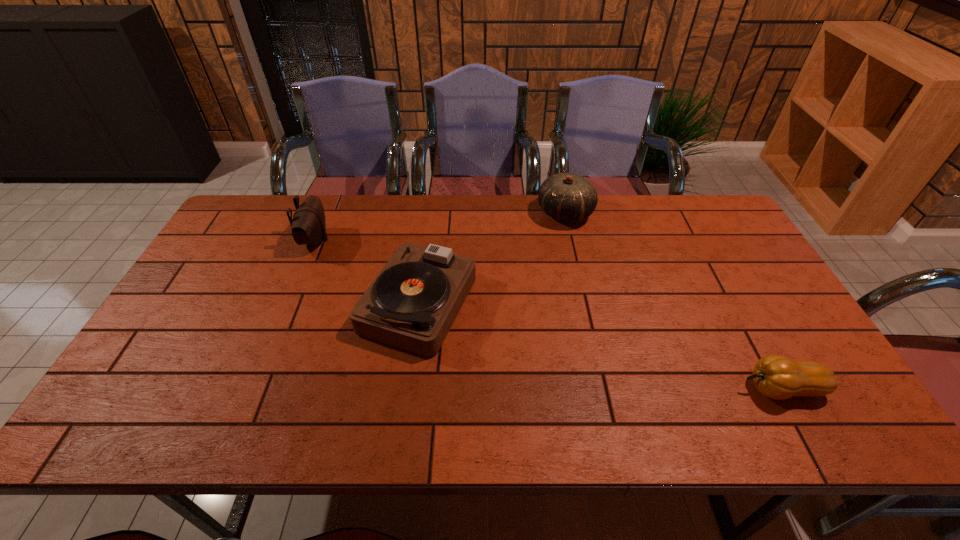
Find the location of `free space at the right edge of the desktop`. free space at the right edge of the desktop is located at coordinates (699, 256).

Locate an element on the screen. vacant region at the far left corner of the desktop is located at coordinates (252, 238).

I want to click on vacant space at the far right corner of the desktop, so click(x=679, y=201).

I want to click on free space between the pouch and the shorter gourd, so click(x=548, y=315).

Find the location of a particular element. The height and width of the screenshot is (540, 960). vacant area that lies between the leftmost object and the shorter gourd is located at coordinates 548,315.

Identify the location of unoccupied area between the second object from left to right and the shorter gourd. (600, 346).

You are a GUI agent. You are given a task and a screenshot of the screen. Output one action in this format:
    pyautogui.click(x=<x>, y=<y>)
    Task: Click on the blank region between the pouch and the third object from right to left
    The height and width of the screenshot is (540, 960).
    Given the screenshot: What is the action you would take?
    pyautogui.click(x=367, y=271)

At what (x,y) coordinates should I click in order to perform the action: click on empty space that is in between the nearer gourd and the record player. Please return your answer as a coordinate pair (x, y). This screenshot has height=540, width=960. Looking at the image, I should click on (600, 346).

This screenshot has height=540, width=960. Identify the location of vacant space that's between the taller gourd and the third object from right to left. click(x=492, y=258).

Locate an element on the screen. The width and height of the screenshot is (960, 540). vacant area that lies between the farther gourd and the third object from right to left is located at coordinates (492, 258).